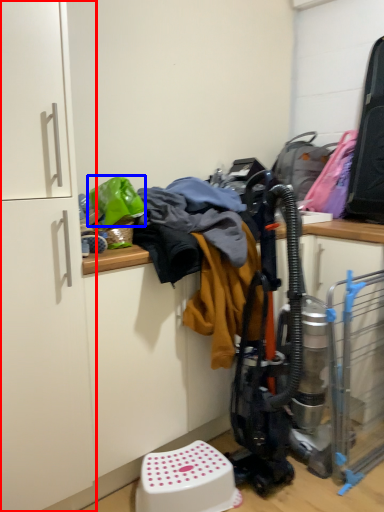
Question: Among these objects, which one is nearest to the camera, cabinetry (highlighted by a red box) or clothing (highlighted by a blue box)?

Choices:
 (A) cabinetry
 (B) clothing

Answer: (A)